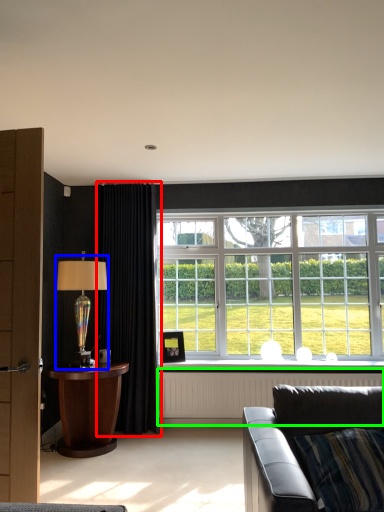
Question: Estimate the real-world distances between objects in this image. Which object is closer to curtain (highlighted by a red box), table lamp (highlighted by a blue box) or radiator (highlighted by a green box)?

Choices:
 (A) table lamp
 (B) radiator

Answer: (A)